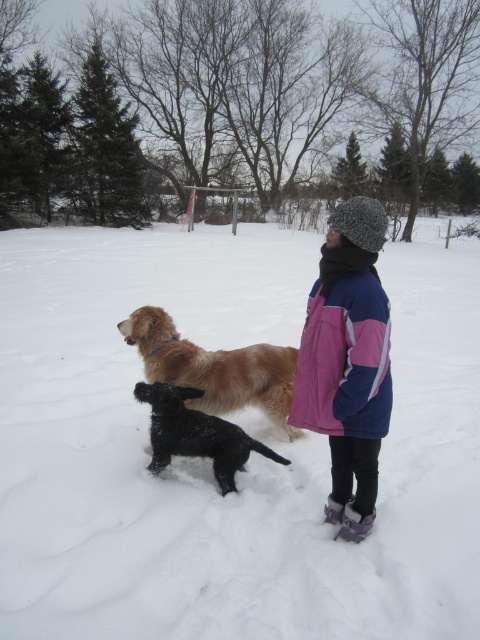
You are a photographer trying to capture the best shot of the two points in the winter scene. Which point, point (402, 538) or point (191, 376), is positioned closer to the camera?

Point (402, 538) is closer to the viewer than point (191, 376).

You are a photographer trying to capture a photo of the golden fur dog at center without the pink fleece jacket at center blocking the view. Based on their heights, is the jacket likely to block the dog from view?

The pink fleece jacket at center is taller than golden fur dog at center, so the jacket is likely to block the dog from view.